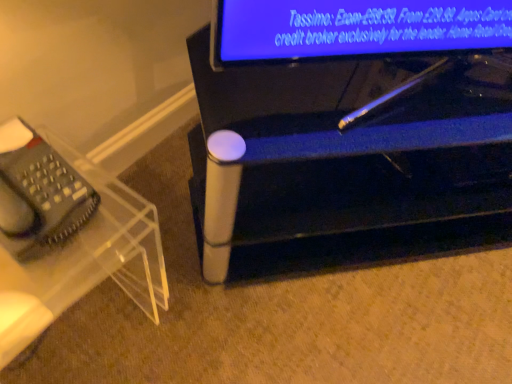
What are the coordinates of `clear plastic telephone at left` in the screenshot? It's located at (38, 194).

What do you see at coordinates (341, 168) in the screenshot?
I see `metallic silver pen at lower center, marked as the second furniture in a left-to-right arrangement` at bounding box center [341, 168].

Locate an element on the screen. transparent acrylic phone stand at left, the 1th furniture in the left-to-right sequence is located at coordinates (67, 236).

Identify the location of clear plastic telephone at left. The width and height of the screenshot is (512, 384). [38, 194].

Which object is more forward, transparent acrylic phone stand at left, arranged as the 2th furniture when viewed from the right, or metallic silver pen at lower center, the 1th furniture from the right?

transparent acrylic phone stand at left, arranged as the 2th furniture when viewed from the right, is more forward.

Is transparent acrylic phone stand at left, arranged as the 2th furniture when viewed from the right, facing away from metallic silver pen at lower center, marked as the second furniture in a left-to-right arrangement?

transparent acrylic phone stand at left, arranged as the 2th furniture when viewed from the right, is not turned away from metallic silver pen at lower center, marked as the second furniture in a left-to-right arrangement.

From the image's perspective, which is above, transparent acrylic phone stand at left, the 1th furniture in the left-to-right sequence, or metallic silver pen at lower center, marked as the second furniture in a left-to-right arrangement?

metallic silver pen at lower center, marked as the second furniture in a left-to-right arrangement, is shown above in the image.

Which is more to the left, transparent acrylic phone stand at left, arranged as the 2th furniture when viewed from the right, or metallic silver pen at lower center, marked as the second furniture in a left-to-right arrangement?

transparent acrylic phone stand at left, arranged as the 2th furniture when viewed from the right.

Considering the relative sizes of clear plastic telephone at left and transparent acrylic phone stand at left, arranged as the 2th furniture when viewed from the right, in the image provided, is clear plastic telephone at left bigger than transparent acrylic phone stand at left, arranged as the 2th furniture when viewed from the right,?

No.

From a real-world perspective, is clear plastic telephone at left positioned above or below transparent acrylic phone stand at left, the 1th furniture in the left-to-right sequence?

In terms of real-world spatial position, clear plastic telephone at left is above transparent acrylic phone stand at left, the 1th furniture in the left-to-right sequence.

You are a GUI agent. You are given a task and a screenshot of the screen. Output one action in this format:
    pyautogui.click(x=<x>, y=<y>)
    Task: Click on the equipment that appears above the transparent acrylic phone stand at left, arranged as the 2th furniture when viewed from the right (from the image's perspective)
    
    Given the screenshot: What is the action you would take?
    pyautogui.click(x=38, y=194)

Is clear plastic telephone at left aimed at transparent acrylic phone stand at left, arranged as the 2th furniture when viewed from the right?

No, clear plastic telephone at left is not oriented towards transparent acrylic phone stand at left, arranged as the 2th furniture when viewed from the right.

Where is `furniture above the transparent acrylic phone stand at left, arranged as the 2th furniture when viewed from the right (from the image's perspective)`? furniture above the transparent acrylic phone stand at left, arranged as the 2th furniture when viewed from the right (from the image's perspective) is located at coordinates (341, 168).

From the image's perspective, is metallic silver pen at lower center, marked as the second furniture in a left-to-right arrangement, under transparent acrylic phone stand at left, the 1th furniture in the left-to-right sequence?

No.

Is metallic silver pen at lower center, marked as the second furniture in a left-to-right arrangement, facing away from transparent acrylic phone stand at left, arranged as the 2th furniture when viewed from the right?

No, metallic silver pen at lower center, marked as the second furniture in a left-to-right arrangement,'s orientation is not away from transparent acrylic phone stand at left, arranged as the 2th furniture when viewed from the right.

Considering the positions of points (226, 175) and (2, 151), is point (226, 175) farther from camera compared to point (2, 151)?

Yes.

Can clear plastic telephone at left be found inside transparent acrylic phone stand at left, the 1th furniture in the left-to-right sequence?

No, clear plastic telephone at left is not inside transparent acrylic phone stand at left, the 1th furniture in the left-to-right sequence.

Looking at this image, is transparent acrylic phone stand at left, arranged as the 2th furniture when viewed from the right, wider or thinner than clear plastic telephone at left?

Considering their sizes, transparent acrylic phone stand at left, arranged as the 2th furniture when viewed from the right, looks broader than clear plastic telephone at left.

Is transparent acrylic phone stand at left, arranged as the 2th furniture when viewed from the right, positioned with its back to clear plastic telephone at left?

No, transparent acrylic phone stand at left, arranged as the 2th furniture when viewed from the right, is not facing away from clear plastic telephone at left.

Is metallic silver pen at lower center, the 1th furniture from the right, a part of clear plastic telephone at left?

No, metallic silver pen at lower center, the 1th furniture from the right, is located outside of clear plastic telephone at left.

Is clear plastic telephone at left positioned behind metallic silver pen at lower center, marked as the second furniture in a left-to-right arrangement?

That is False.

Consider the image. Can you confirm if clear plastic telephone at left is thinner than metallic silver pen at lower center, the 1th furniture from the right?

Yes.

The height and width of the screenshot is (384, 512). I want to click on equipment in front of the metallic silver pen at lower center, the 1th furniture from the right, so click(38, 194).

From a real-world perspective, who is located lower, metallic silver pen at lower center, marked as the second furniture in a left-to-right arrangement, or clear plastic telephone at left?

metallic silver pen at lower center, marked as the second furniture in a left-to-right arrangement, is physically lower.

Is metallic silver pen at lower center, marked as the second furniture in a left-to-right arrangement, oriented towards clear plastic telephone at left?

No, metallic silver pen at lower center, marked as the second furniture in a left-to-right arrangement, is not turned towards clear plastic telephone at left.

Find the location of a particular element. This screenshot has width=512, height=384. equipment above the metallic silver pen at lower center, the 1th furniture from the right (from a real-world perspective) is located at coordinates (38, 194).

In the image, there is a metallic silver pen at lower center, the 1th furniture from the right. What are the coordinates of `furniture below it (from the image's perspective)` in the screenshot? It's located at (67, 236).

In order to click on equipment on the right of transparent acrylic phone stand at left, arranged as the 2th furniture when viewed from the right in this screenshot , I will do `click(38, 194)`.

Which object lies further to the anchor point clear plastic telephone at left, metallic silver pen at lower center, the 1th furniture from the right, or transparent acrylic phone stand at left, arranged as the 2th furniture when viewed from the right?

metallic silver pen at lower center, the 1th furniture from the right, lies further to clear plastic telephone at left than the other object.

Looking at the image, which one is located further to metallic silver pen at lower center, the 1th furniture from the right, clear plastic telephone at left or transparent acrylic phone stand at left, arranged as the 2th furniture when viewed from the right?

clear plastic telephone at left lies further to metallic silver pen at lower center, the 1th furniture from the right, than the other object.

Considering their positions, is clear plastic telephone at left positioned further to transparent acrylic phone stand at left, arranged as the 2th furniture when viewed from the right, than metallic silver pen at lower center, marked as the second furniture in a left-to-right arrangement?

metallic silver pen at lower center, marked as the second furniture in a left-to-right arrangement, is positioned further to the anchor transparent acrylic phone stand at left, arranged as the 2th furniture when viewed from the right.

Which object lies nearer to the anchor point transparent acrylic phone stand at left, arranged as the 2th furniture when viewed from the right, metallic silver pen at lower center, the 1th furniture from the right, or clear plastic telephone at left?

The object closer to transparent acrylic phone stand at left, arranged as the 2th furniture when viewed from the right, is clear plastic telephone at left.

When comparing their distances from metallic silver pen at lower center, marked as the second furniture in a left-to-right arrangement, does transparent acrylic phone stand at left, the 1th furniture in the left-to-right sequence, or clear plastic telephone at left seem further?

Based on the image, clear plastic telephone at left appears to be further to metallic silver pen at lower center, marked as the second furniture in a left-to-right arrangement.

Based on their spatial positions, is transparent acrylic phone stand at left, the 1th furniture in the left-to-right sequence, or metallic silver pen at lower center, marked as the second furniture in a left-to-right arrangement, further from clear plastic telephone at left?

The object further to clear plastic telephone at left is metallic silver pen at lower center, marked as the second furniture in a left-to-right arrangement.

What are the coordinates of `equipment between transparent acrylic phone stand at left, arranged as the 2th furniture when viewed from the right, and metallic silver pen at lower center, the 1th furniture from the right` in the screenshot? It's located at (38, 194).